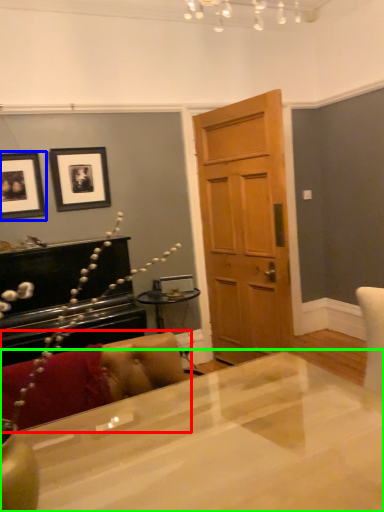
Question: Considering the real-world distances, which object is farthest from couch (highlighted by a red box)? picture frame (highlighted by a blue box) or desk (highlighted by a green box)?

Choices:
 (A) picture frame
 (B) desk

Answer: (A)